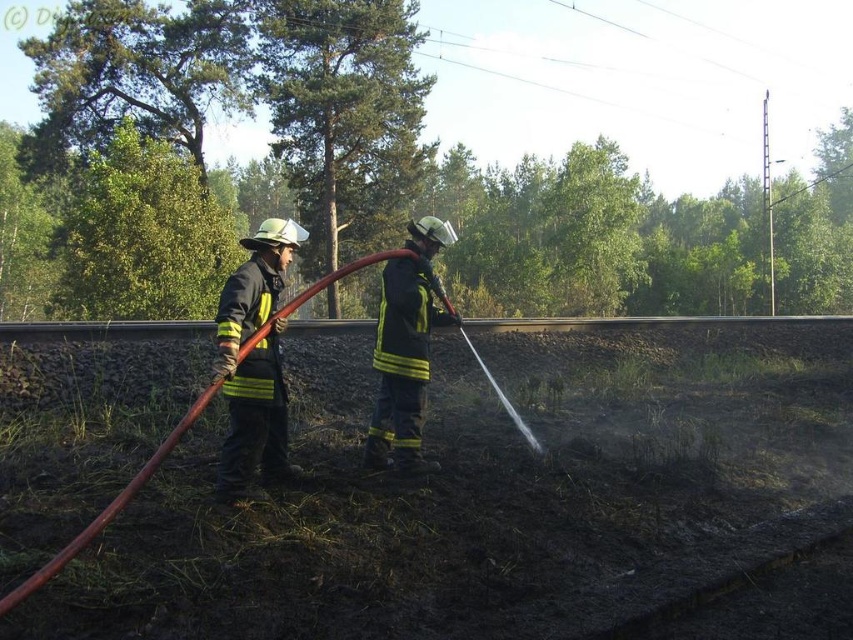
Question: Which object appears closest to the camera in this image?

Choices:
 (A) reflective yellow jacket at center
 (B) reflective yellow uniform at center

Answer: (A)

Question: Is reflective yellow jacket at center below reflective yellow uniform at center?

Choices:
 (A) yes
 (B) no

Answer: (A)

Question: Is reflective yellow jacket at center to the left of reflective yellow uniform at center from the viewer's perspective?

Choices:
 (A) no
 (B) yes

Answer: (B)

Question: Can you confirm if reflective yellow jacket at center is smaller than reflective yellow uniform at center?

Choices:
 (A) yes
 (B) no

Answer: (B)

Question: Which point is farther to the camera?

Choices:
 (A) reflective yellow jacket at center
 (B) reflective yellow uniform at center

Answer: (B)